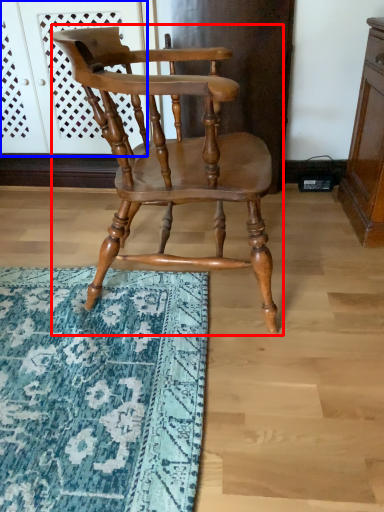
Question: Which point is closer to the camera, chair (highlighted by a red box) or screen door (highlighted by a blue box)?

Choices:
 (A) chair
 (B) screen door

Answer: (A)